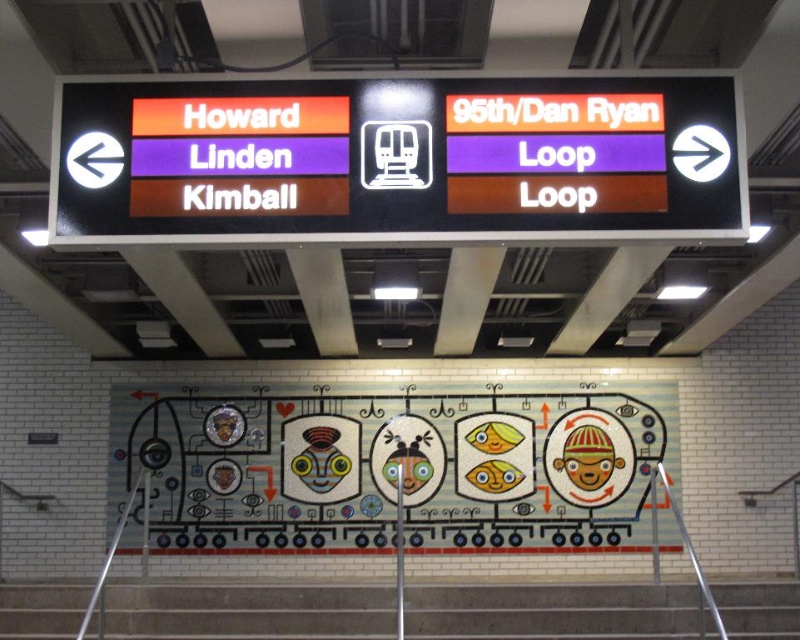
Question: Can you confirm if matte orange sign at center is smaller than gray concrete stairs at lower center?

Choices:
 (A) no
 (B) yes

Answer: (A)

Question: Can you confirm if matte orange sign at center is positioned to the left of gray concrete stairs at lower center?

Choices:
 (A) no
 (B) yes

Answer: (A)

Question: Which point is farther from the camera taking this photo?

Choices:
 (A) (202, 609)
 (B) (204, 122)

Answer: (A)

Question: Which point is closer to the camera taking this photo?

Choices:
 (A) (432, 164)
 (B) (740, 605)

Answer: (A)

Question: Is matte orange sign at center below gray concrete stairs at lower center?

Choices:
 (A) yes
 (B) no

Answer: (B)

Question: Which point appears farthest from the camera in this image?

Choices:
 (A) 680,237
 (B) 74,628

Answer: (B)